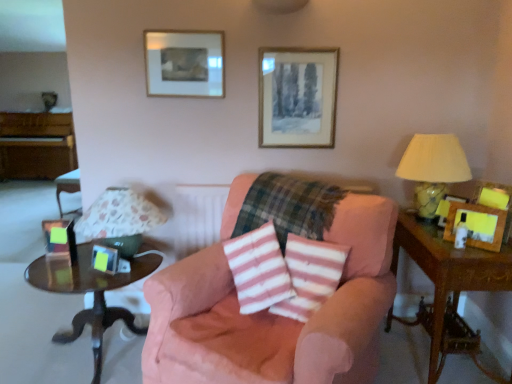
Question: Can you confirm if wooden picture frame at right, the first picture frame viewed from the right, is bigger than pink striped fabric at center?

Choices:
 (A) no
 (B) yes

Answer: (A)

Question: Is wooden picture frame at right, placed as the 3th picture frame when sorted from bottom to top, to the left of pink striped fabric at center from the viewer's perspective?

Choices:
 (A) no
 (B) yes

Answer: (A)

Question: Does wooden picture frame at right, the first picture frame viewed from the right, have a lesser height compared to pink striped fabric at center?

Choices:
 (A) no
 (B) yes

Answer: (B)

Question: Is pink striped fabric at center completely or partially inside wooden picture frame at right, placed as the 3th picture frame when sorted from bottom to top?

Choices:
 (A) yes
 (B) no

Answer: (B)

Question: From the image's perspective, is wooden picture frame at right, placed as the fifth picture frame when sorted from left to right, over pink striped fabric at center?

Choices:
 (A) yes
 (B) no

Answer: (A)

Question: Considering the relative positions of yellow fabric lampshade at right, the 1th table lamp positioned from the right, and wooden side table at right, marked as the 2th table in a left-to-right arrangement, in the image provided, is yellow fabric lampshade at right, the 1th table lamp positioned from the right, to the left or to the right of wooden side table at right, marked as the 2th table in a left-to-right arrangement,?

Choices:
 (A) right
 (B) left

Answer: (B)

Question: Is yellow fabric lampshade at right, the 1th table lamp positioned from the right, bigger or smaller than wooden side table at right, the 1th table positioned from the right?

Choices:
 (A) small
 (B) big

Answer: (A)

Question: Relative to wooden side table at right, marked as the 2th table in a left-to-right arrangement, is yellow fabric lampshade at right, the 2th table lamp viewed from the left, in front or behind?

Choices:
 (A) front
 (B) behind

Answer: (B)

Question: Do you think yellow fabric lampshade at right, the 1th table lamp positioned from the right, is within wooden side table at right, marked as the 2th table in a left-to-right arrangement, or outside of it?

Choices:
 (A) outside
 (B) inside

Answer: (A)

Question: From a real-world perspective, is pink fabric chair at center positioned above or below matte black picture frame at left, placed as the third picture frame when sorted from front to back?

Choices:
 (A) above
 (B) below

Answer: (B)

Question: Which is correct: pink fabric chair at center is inside matte black picture frame at left, which is counted as the 5th picture frame, starting from the right, or outside of it?

Choices:
 (A) inside
 (B) outside

Answer: (B)

Question: Considering the positions of pink fabric chair at center and matte black picture frame at left, which is counted as the 5th picture frame, starting from the right, in the image, is pink fabric chair at center bigger or smaller than matte black picture frame at left, which is counted as the 5th picture frame, starting from the right,?

Choices:
 (A) small
 (B) big

Answer: (B)

Question: From the image's perspective, is pink fabric chair at center located above or below matte black picture frame at left, marked as the 1th picture frame in a left-to-right arrangement?

Choices:
 (A) below
 (B) above

Answer: (A)

Question: Does point (434, 331) appear closer or farther from the camera than point (424, 162)?

Choices:
 (A) farther
 (B) closer

Answer: (B)

Question: From a real-world perspective, relative to yellow fabric lampshade at right, the 1th table lamp positioned from the right, is wooden side table at right, marked as the 2th table in a left-to-right arrangement, vertically above or below?

Choices:
 (A) above
 (B) below

Answer: (B)